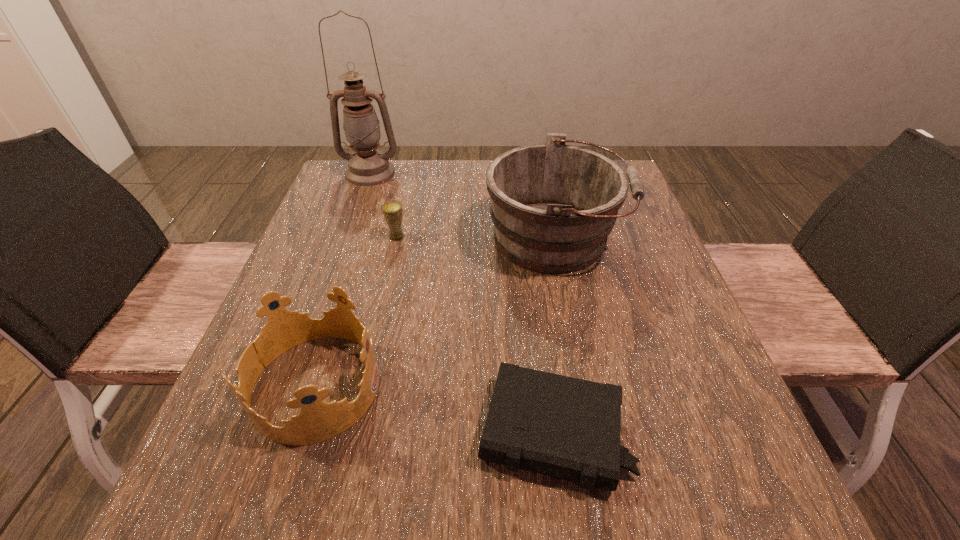
I want to click on vacant area situated on the back of the shortest object, so click(541, 333).

Identify the location of oil lamp at the far edge. The height and width of the screenshot is (540, 960). (367, 167).

Locate an element on the screen. Image resolution: width=960 pixels, height=540 pixels. wine bucket situated at the far edge is located at coordinates (553, 206).

I want to click on object present at the near edge, so click(x=568, y=428).

Where is `oil lamp that is at the left edge`? oil lamp that is at the left edge is located at coordinates (367, 167).

You are a GUI agent. You are given a task and a screenshot of the screen. Output one action in this format:
    pyautogui.click(x=<x>, y=<y>)
    Task: Click on the tiara that is at the left edge
    Image resolution: width=960 pixels, height=540 pixels.
    Given the screenshot: What is the action you would take?
    pyautogui.click(x=318, y=421)

Where is `object present at the right edge`? Image resolution: width=960 pixels, height=540 pixels. object present at the right edge is located at coordinates (553, 206).

This screenshot has width=960, height=540. I want to click on object that is at the far left corner, so click(x=367, y=167).

Where is `object at the far right corner`? object at the far right corner is located at coordinates (553, 206).

At what (x,y) coordinates should I click in order to perform the action: click on vacant position at the far edge of the desktop. Please return your answer as a coordinate pair (x, y). The width and height of the screenshot is (960, 540). Looking at the image, I should click on (430, 163).